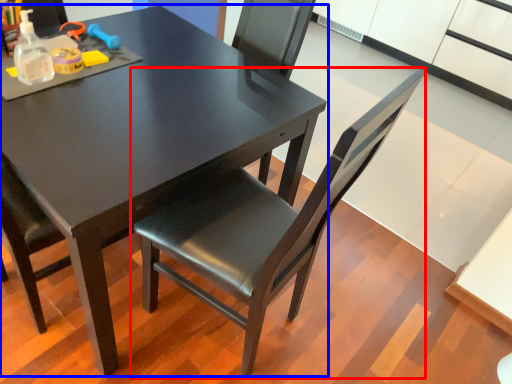
Question: Among these objects, which one is nearest to the camera, chair (highlighted by a red box) or table (highlighted by a blue box)?

Choices:
 (A) chair
 (B) table

Answer: (A)